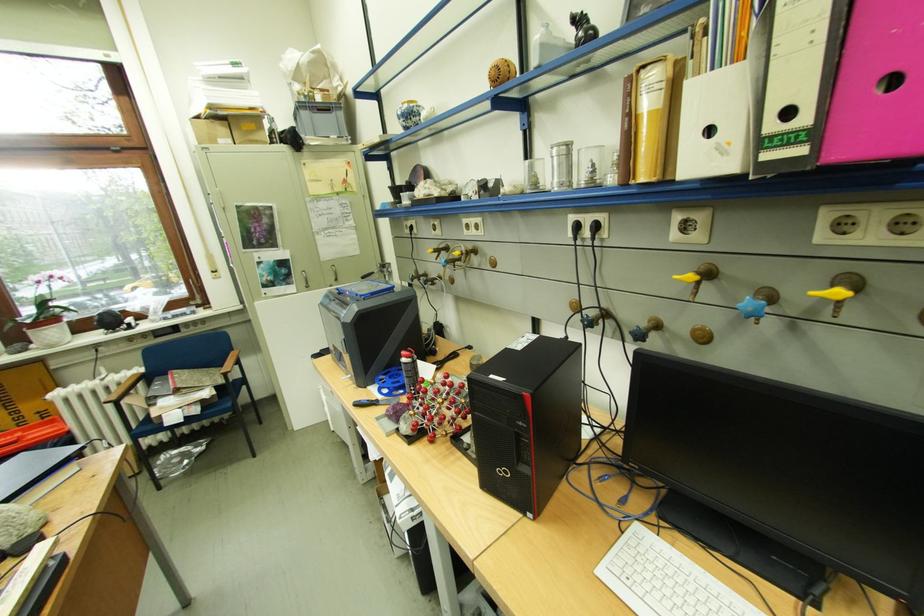
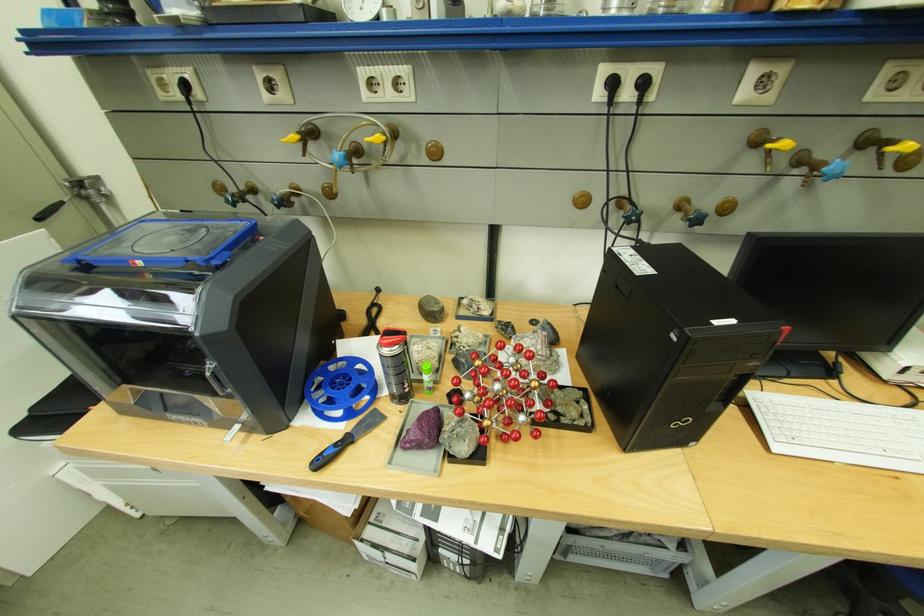
Locate, in the second image, the point that corresponds to pixel 379 402 in the first image.

(346, 446)